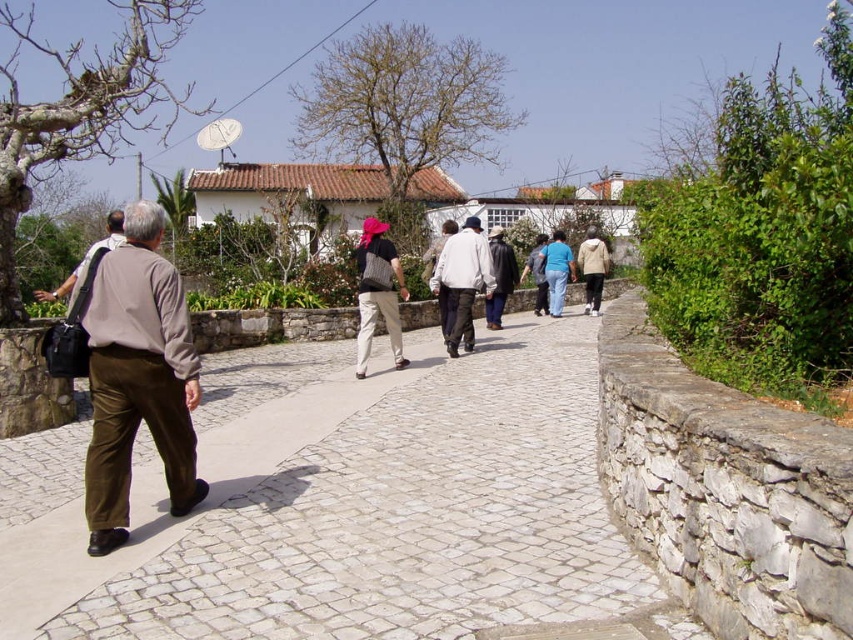
Between brown corduroy pants at left and matte black backpack at center, which one appears on the left side from the viewer's perspective?

From the viewer's perspective, brown corduroy pants at left appears more on the left side.

Is brown corduroy pants at left smaller than matte black backpack at center?

Actually, brown corduroy pants at left might be larger than matte black backpack at center.

Which is behind, point (114, 321) or point (392, 272)?

Point (392, 272)

Find the location of a particular element. brown corduroy pants at left is located at coordinates (138, 378).

Which is more to the right, brown corduroy pants at left or beige fabric jacket at center?

beige fabric jacket at center

Does point (154, 333) come in front of point (596, 282)?

Yes, it is in front of point (596, 282).

Find the location of a particular element. The height and width of the screenshot is (640, 853). brown corduroy pants at left is located at coordinates (138, 378).

Is point (434, 291) closer to camera compared to point (572, 264)?

Yes, point (434, 291) is in front of point (572, 264).

Who is positioned more to the right, light gray fabric jacket at center or blue cotton shirt at center?

blue cotton shirt at center

Between point (444, 340) and point (555, 253), which one is positioned in front?

Point (444, 340)

You are a GUI agent. You are given a task and a screenshot of the screen. Output one action in this format:
    pyautogui.click(x=<x>, y=<y>)
    Task: Click on the light gray fabric jacket at center
    
    Given the screenshot: What is the action you would take?
    pyautogui.click(x=462, y=282)